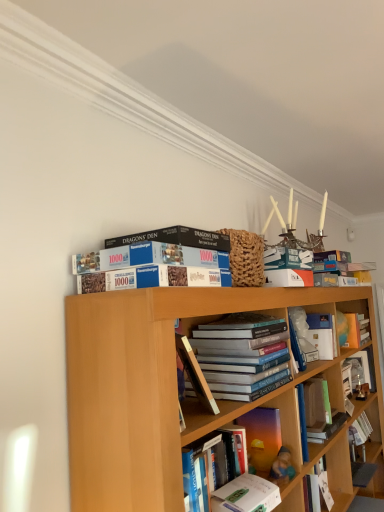
Question: Is point pyautogui.click(x=357, y=437) positioned closer to the camera than point pyautogui.click(x=178, y=352)?

Choices:
 (A) farther
 (B) closer

Answer: (A)

Question: Looking at the image, does hardcover book at center, which appears as the seventh book when viewed from the front, seem bigger or smaller compared to hardcover book at center?

Choices:
 (A) small
 (B) big

Answer: (A)

Question: Estimate the real-world distances between objects in this image. Which object is farther from the hardcover book at center, which appears as the seventh book when viewed from the front?

Choices:
 (A) wooden photo frame at right, placed as the ninth book when sorted from front to back
 (B) matte black puzzle box at upper center, which ranks as the 9th book in back-to-front order
 (C) white glossy book at center, which is counted as the fourth book, starting from the back
 (D) hardcover book at center
 (E) translucent plastic book at center, the sixth book in the back-to-front sequence

Answer: (B)

Question: Which is nearer to the hardcover books at center, the third book in the front-to-back sequence?

Choices:
 (A) white glossy book at center, which is counted as the fourth book, starting from the back
 (B) hardcover book at center
 (C) orange matte bookshelf at upper center, the eighth book in the front-to-back sequence
 (D) white matte book at center, arranged as the 8th book when viewed from the back
 (E) hardcover book at center, which appears as the seventh book when viewed from the front

Answer: (B)